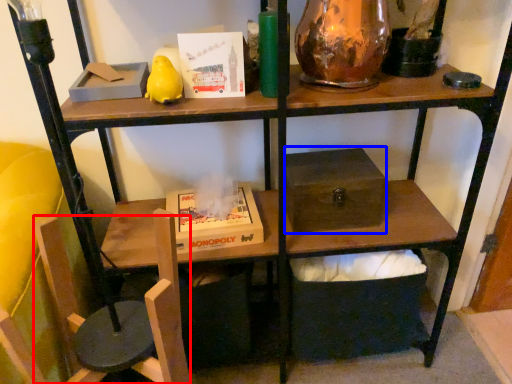
Question: Among these objects, which one is nearest to the camera, swivel chair (highlighted by a red box) or box (highlighted by a blue box)?

Choices:
 (A) swivel chair
 (B) box

Answer: (A)